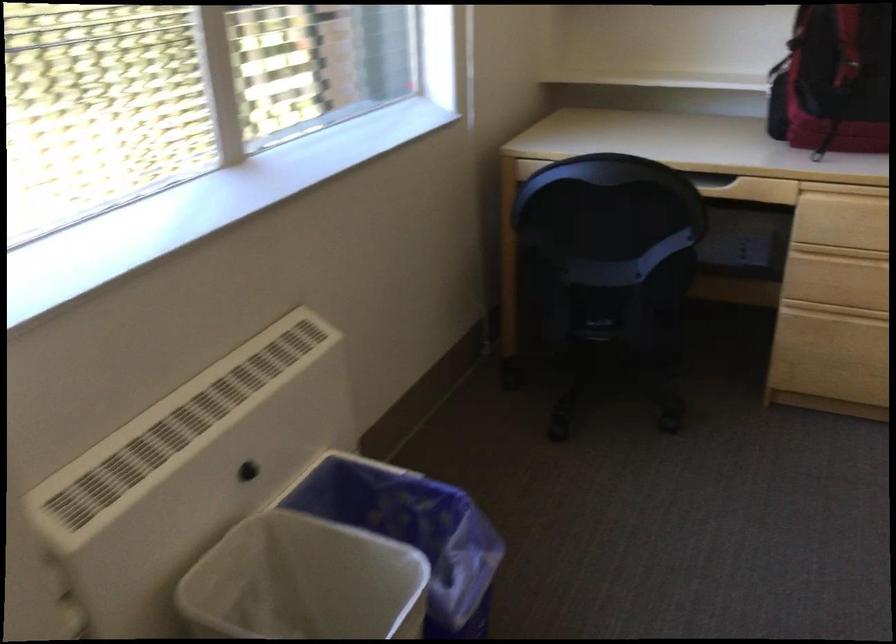
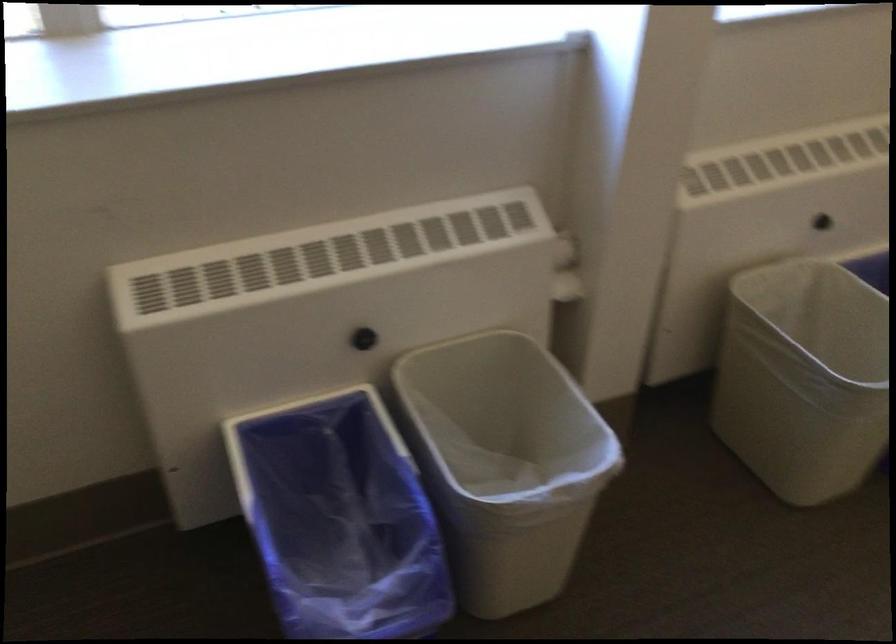
The first image is from the beginning of the video and the second image is from the end. How did the camera likely rotate when shooting the video?

The camera rotated toward left-down.